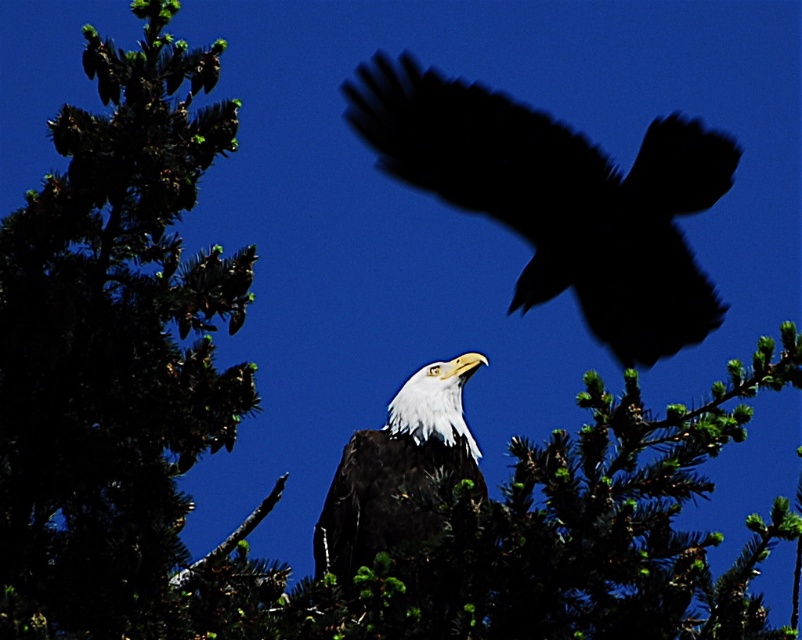
Who is more distant from viewer, (80, 564) or (551, 136)?

The point (551, 136) is more distant.

This screenshot has width=802, height=640. I want to click on green leafy tree at upper left, so click(114, 346).

Describe the element at coordinates (114, 346) in the screenshot. I see `green leafy tree at upper left` at that location.

This screenshot has width=802, height=640. Identify the location of green leafy tree at upper left. pos(114,346).

Measure the distance between point [397,100] and camera.

They are 20.63 feet apart.

At what (x,y) coordinates should I click in order to perform the action: click on white feathered bald eagle at center. Please return your answer as a coordinate pair (x, y). This screenshot has height=640, width=802. Looking at the image, I should click on (561, 198).

Between green leafy tree at upper left and white glossy eagle at center, which one has more height?

Standing taller between the two is green leafy tree at upper left.

Does green leafy tree at upper left have a smaller size compared to white glossy eagle at center?

Actually, green leafy tree at upper left might be larger than white glossy eagle at center.

Where is `green leafy tree at upper left`? green leafy tree at upper left is located at coordinates (114, 346).

Identify the location of green leafy tree at upper left. This screenshot has width=802, height=640. (114, 346).